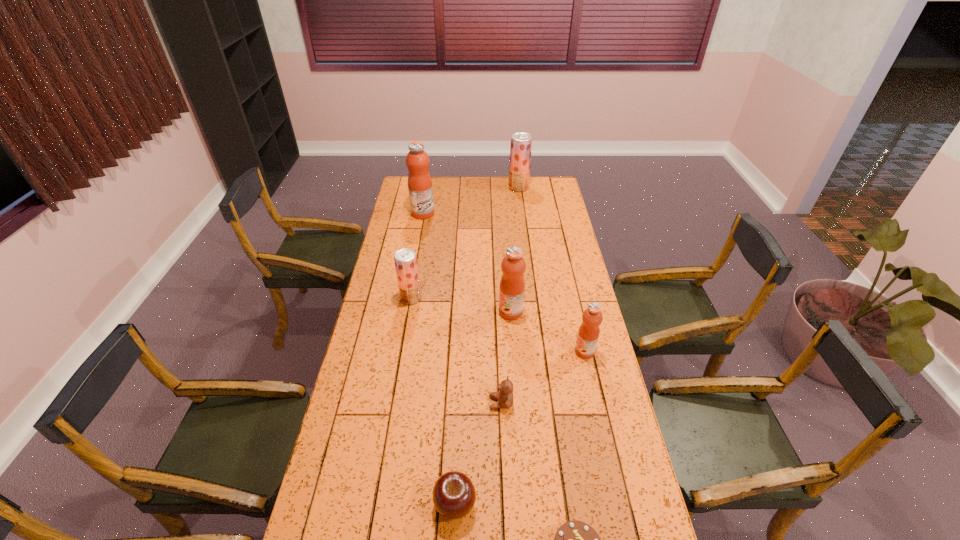
At what (x,y) coordinates should I click in order to perform the action: click on teddy bear. Please return your answer as a coordinate pair (x, y). The image size is (960, 540). Looking at the image, I should click on (505, 395).

The height and width of the screenshot is (540, 960). I want to click on brown teddy bear, so click(x=505, y=395).

The image size is (960, 540). I want to click on red apple, so click(454, 496).

Where is `the sixth object from right to left`? This screenshot has height=540, width=960. the sixth object from right to left is located at coordinates (454, 496).

At what (x,y) coordinates should I click in order to perform the action: click on blank space located on the front label of the fourth nearest fruit juice. Please return your answer as a coordinate pair (x, y). The height and width of the screenshot is (540, 960). Looking at the image, I should click on coord(512,213).

In order to click on vacant region located on the front of the farthest fruit juice in this screenshot , I will do `click(524, 230)`.

Locate an element on the screen. The height and width of the screenshot is (540, 960). free space located 0.350m on the front label of the second biggest orange fruit juice is located at coordinates (410, 312).

The width and height of the screenshot is (960, 540). I want to click on vacant point located 0.260m on the front label of the second biggest orange fruit juice, so click(433, 312).

The height and width of the screenshot is (540, 960). I want to click on vacant space located 0.070m on the front label of the second biggest orange fruit juice, so click(481, 312).

I want to click on free space located 0.110m on the left of the nearer strawberry fruit juice, so click(x=373, y=298).